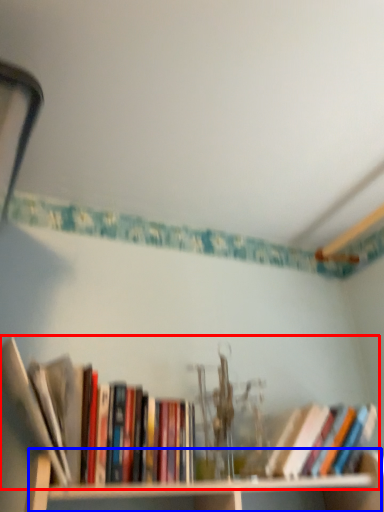
Question: Among these objects, which one is nearest to the camera, book (highlighted by a red box) or cabinet (highlighted by a blue box)?

Choices:
 (A) book
 (B) cabinet

Answer: (A)